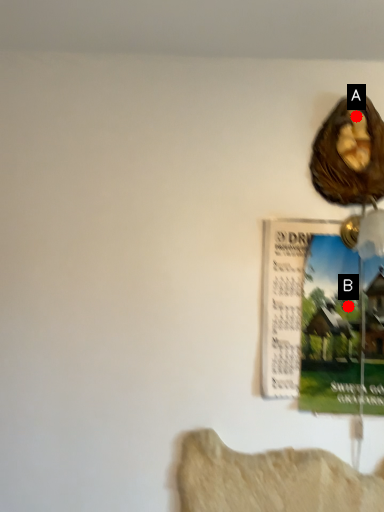
Question: Two points are circled on the image, labeled by A and B beside each circle. Which point is farther from the camera taking this photo?

Choices:
 (A) A is further
 (B) B is further

Answer: (B)